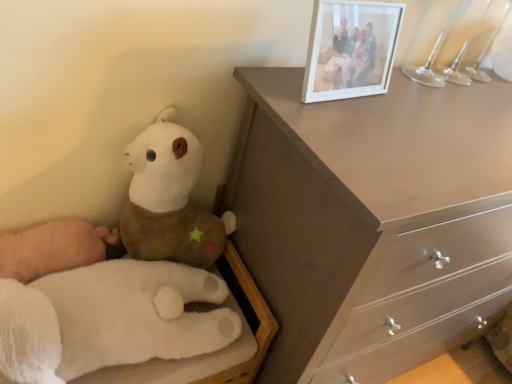
Question: Is white plush toy at left, acting as the first toy starting from the top, far from matte brown dresser at upper right?

Choices:
 (A) yes
 (B) no

Answer: (B)

Question: Is white plush toy at left, acting as the first toy starting from the top, in contact with matte brown dresser at upper right?

Choices:
 (A) yes
 (B) no

Answer: (B)

Question: From a real-world perspective, is white plush toy at left, which ranks as the second toy in bottom-to-top order, over matte brown dresser at upper right?

Choices:
 (A) yes
 (B) no

Answer: (A)

Question: Could you tell me if white plush toy at left, acting as the first toy starting from the top, is turned towards matte brown dresser at upper right?

Choices:
 (A) yes
 (B) no

Answer: (B)

Question: Is white plush toy at left, which ranks as the second toy in bottom-to-top order, facing away from matte brown dresser at upper right?

Choices:
 (A) yes
 (B) no

Answer: (B)

Question: Is white plush toy at left, acting as the first toy starting from the top, at the left side of matte brown dresser at upper right?

Choices:
 (A) yes
 (B) no

Answer: (A)

Question: Considering the relative positions of matte brown dresser at upper right and white plush hand at lower left, the second toy from the top, in the image provided, is matte brown dresser at upper right in front of white plush hand at lower left, the second toy from the top,?

Choices:
 (A) no
 (B) yes

Answer: (B)

Question: Is matte brown dresser at upper right at the left side of white plush hand at lower left, the second toy from the top?

Choices:
 (A) no
 (B) yes

Answer: (A)

Question: Would you say matte brown dresser at upper right is outside white plush hand at lower left, which is the first toy in bottom-to-top order?

Choices:
 (A) no
 (B) yes

Answer: (B)

Question: From a real-world perspective, is matte brown dresser at upper right under white plush hand at lower left, which is the first toy in bottom-to-top order?

Choices:
 (A) no
 (B) yes

Answer: (B)

Question: Are matte brown dresser at upper right and white plush hand at lower left, which is the first toy in bottom-to-top order, making contact?

Choices:
 (A) yes
 (B) no

Answer: (B)

Question: Is matte brown dresser at upper right taller than white plush hand at lower left, which is the first toy in bottom-to-top order?

Choices:
 (A) no
 (B) yes

Answer: (B)

Question: Can you confirm if matte brown dresser at upper right is positioned to the right of white plush toy at left, which ranks as the second toy in bottom-to-top order?

Choices:
 (A) no
 (B) yes

Answer: (B)